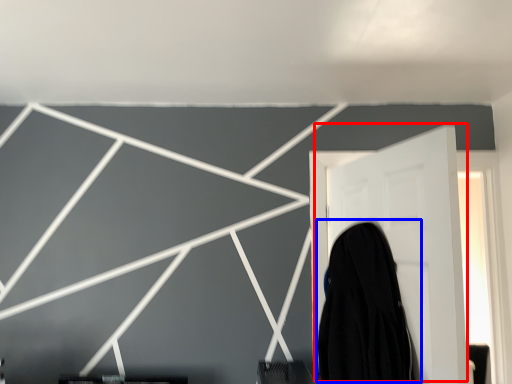
Question: Which object appears farthest to the camera in this image, door (highlighted by a red box) or garment (highlighted by a blue box)?

Choices:
 (A) door
 (B) garment

Answer: (B)